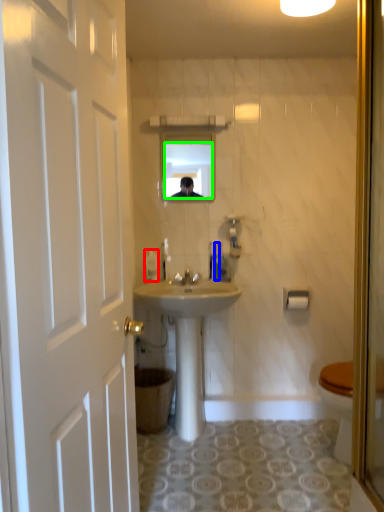
Question: Which object is the closest to the toiletries (highlighted by a red box)? Choose among these: toiletries (highlighted by a blue box) or mirror (highlighted by a green box).

Choices:
 (A) toiletries
 (B) mirror

Answer: (A)